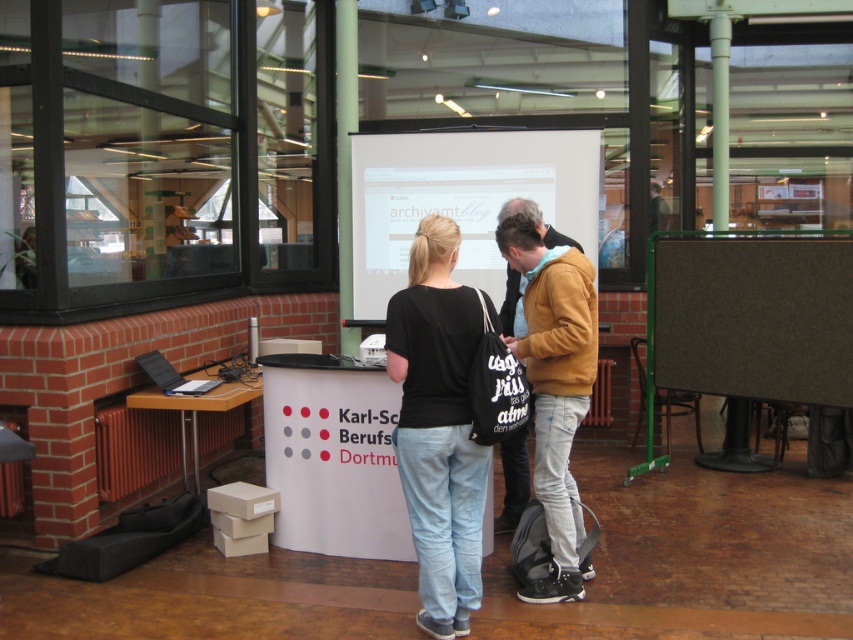
In the scene shown: Which of these two, black cotton shirt at center or matte yellow jacket at center, stands shorter?

matte yellow jacket at center

Does black cotton shirt at center appear under matte yellow jacket at center?

Incorrect, black cotton shirt at center is not positioned below matte yellow jacket at center.

Is point (445, 392) farther from viewer compared to point (508, 208)?

No, (445, 392) is closer to viewer.

Locate an element on the screen. This screenshot has width=853, height=640. black cotton shirt at center is located at coordinates (439, 426).